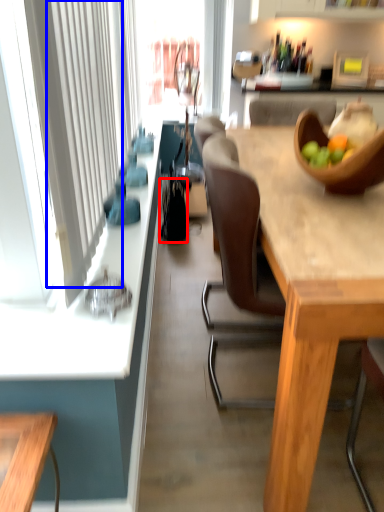
Question: Which object appears closest to the camera in this image, handbag (highlighted by a red box) or curtain (highlighted by a blue box)?

Choices:
 (A) handbag
 (B) curtain

Answer: (B)